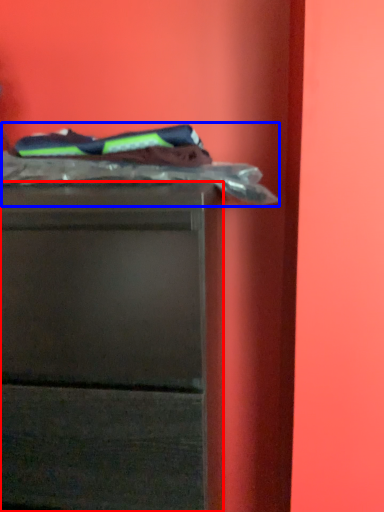
Question: Which of the following is the farthest to the observer, chest of drawers (highlighted by a red box) or laundry (highlighted by a blue box)?

Choices:
 (A) chest of drawers
 (B) laundry

Answer: (B)